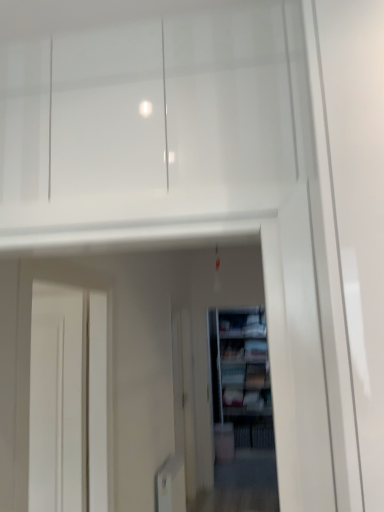
Question: From a real-world perspective, is wooden bookshelf at center above or below matte white cabinet at center?

Choices:
 (A) above
 (B) below

Answer: (B)

Question: In terms of width, does wooden bookshelf at center look wider or thinner when compared to matte white cabinet at center?

Choices:
 (A) wide
 (B) thin

Answer: (B)

Question: Considering the real-world distances, which object is farthest from the matte white cabinet at center?

Choices:
 (A) white glossy screen door at center
 (B) wooden bookshelf at center

Answer: (A)

Question: Considering the real-world distances, which object is farthest from the matte white cabinet at center?

Choices:
 (A) white glossy screen door at center
 (B) wooden bookshelf at center

Answer: (A)